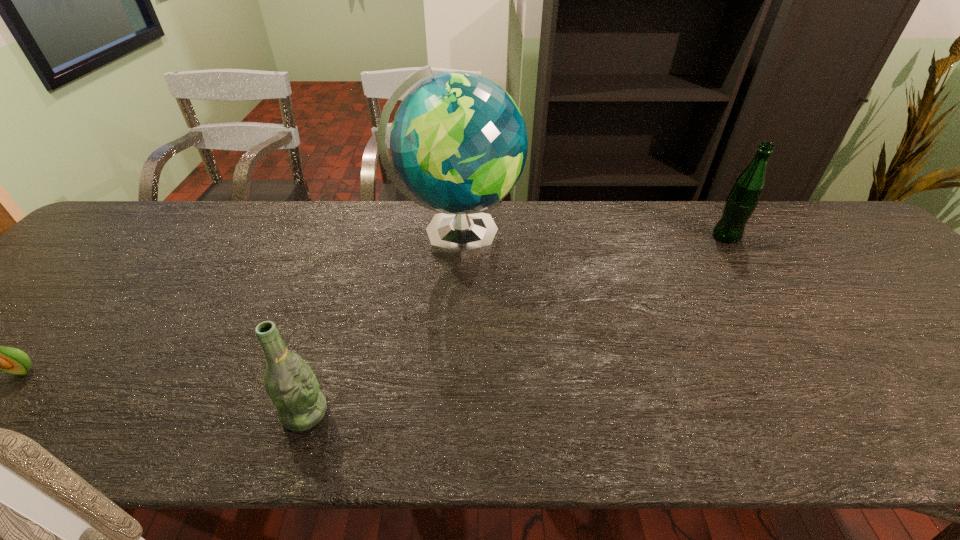
You are a GUI agent. You are given a task and a screenshot of the screen. Output one action in this format:
    pyautogui.click(x=<x>, y=<y>)
    Task: Click on the beer bottle at the far edge
    The image size is (960, 540).
    Given the screenshot: What is the action you would take?
    (741, 202)

The image size is (960, 540). Find the location of `object that is at the near edge`. object that is at the near edge is located at coordinates (290, 383).

The image size is (960, 540). I want to click on blank area at the far edge, so click(x=540, y=216).

This screenshot has width=960, height=540. Find the location of `vacant region at the near edge`. vacant region at the near edge is located at coordinates (536, 429).

Locate an element on the screen. The image size is (960, 540). vacant space at the left edge of the desktop is located at coordinates (48, 296).

Image resolution: width=960 pixels, height=540 pixels. What are the coordinates of `vacant point located between the nearer beer bottle and the right beer bottle` in the screenshot? It's located at (516, 325).

Locate an element on the screen. free space between the nearer beer bottle and the farther beer bottle is located at coordinates (516, 325).

You are a GUI agent. You are given a task and a screenshot of the screen. Output one action in this format:
    pyautogui.click(x=<x>, y=<y>)
    Task: Click on the vacant point located between the rightmost object and the nearest object
    The width and height of the screenshot is (960, 540).
    Given the screenshot: What is the action you would take?
    (x=516, y=325)

Locate an element on the screen. This screenshot has width=960, height=540. free space between the rightmost object and the globe is located at coordinates (591, 237).

Locate an element on the screen. free space between the nearer beer bottle and the tallest object is located at coordinates (381, 325).